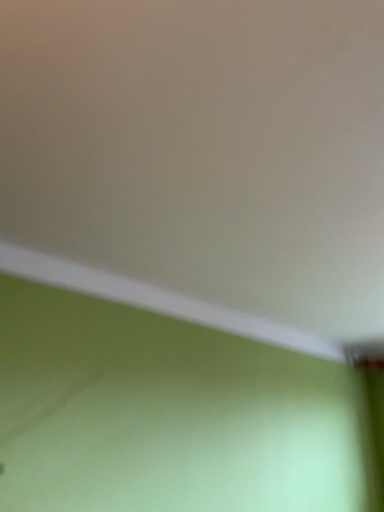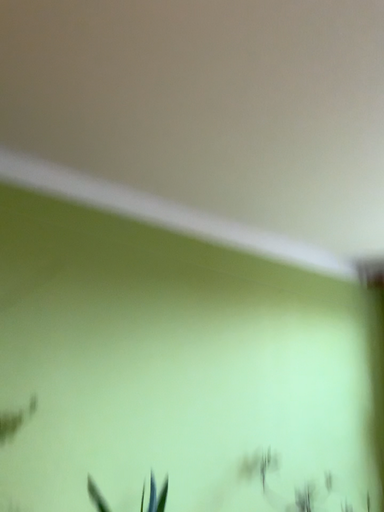
Question: Which way did the camera rotate in the video?

Choices:
 (A) rotated upward
 (B) rotated downward

Answer: (B)